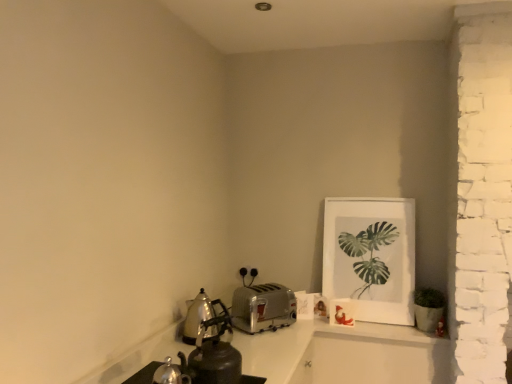
Question: From the image's perspective, is shiny metallic kettle at lower left beneath silver metallic toaster at center, the first kitchen appliance viewed from the right?

Choices:
 (A) yes
 (B) no

Answer: (B)

Question: Considering the relative sizes of shiny metallic kettle at lower left and silver metallic toaster at center, the first kitchen appliance viewed from the right, in the image provided, is shiny metallic kettle at lower left shorter than silver metallic toaster at center, the first kitchen appliance viewed from the right,?

Choices:
 (A) no
 (B) yes

Answer: (A)

Question: From a real-world perspective, is shiny metallic kettle at lower left below silver metallic toaster at center, the first kitchen appliance viewed from the right?

Choices:
 (A) yes
 (B) no

Answer: (B)

Question: Does shiny metallic kettle at lower left lie behind silver metallic toaster at center, the first kitchen appliance viewed from the right?

Choices:
 (A) no
 (B) yes

Answer: (A)

Question: Would you say shiny metallic kettle at lower left is outside silver metallic toaster at center, the second kitchen appliance from the left?

Choices:
 (A) no
 (B) yes

Answer: (B)

Question: From a real-world perspective, is shiny metallic kettle at lower left positioned above or below white matte picture frame at upper right?

Choices:
 (A) above
 (B) below

Answer: (B)

Question: Considering the positions of shiny metallic kettle at lower left and white matte picture frame at upper right in the image, is shiny metallic kettle at lower left taller or shorter than white matte picture frame at upper right?

Choices:
 (A) tall
 (B) short

Answer: (B)

Question: Is shiny metallic kettle at lower left to the left or to the right of white matte picture frame at upper right in the image?

Choices:
 (A) right
 (B) left

Answer: (B)

Question: Relative to white matte picture frame at upper right, is shiny metallic kettle at lower left in front or behind?

Choices:
 (A) front
 (B) behind

Answer: (A)

Question: Considering their positions, is polished stainless steel kettle at left, the second kitchen appliance positioned from the right, located in front of or behind silver metallic toaster at center, the second kitchen appliance from the left?

Choices:
 (A) front
 (B) behind

Answer: (A)

Question: From a real-world perspective, relative to silver metallic toaster at center, the first kitchen appliance viewed from the right, is polished stainless steel kettle at left, the second kitchen appliance positioned from the right, vertically above or below?

Choices:
 (A) above
 (B) below

Answer: (A)

Question: Considering the relative positions of polished stainless steel kettle at left, the second kitchen appliance positioned from the right, and silver metallic toaster at center, the second kitchen appliance from the left, in the image provided, is polished stainless steel kettle at left, the second kitchen appliance positioned from the right, to the left or to the right of silver metallic toaster at center, the second kitchen appliance from the left,?

Choices:
 (A) left
 (B) right

Answer: (A)

Question: From the image's perspective, is polished stainless steel kettle at left, which is the first kitchen appliance in left-to-right order, located above or below silver metallic toaster at center, the second kitchen appliance from the left?

Choices:
 (A) above
 (B) below

Answer: (A)

Question: Based on their sizes in the image, would you say polished stainless steel kettle at left, the second kitchen appliance positioned from the right, is bigger or smaller than shiny metallic kettle at lower left?

Choices:
 (A) small
 (B) big

Answer: (A)

Question: Is polished stainless steel kettle at left, the second kitchen appliance positioned from the right, to the left or to the right of shiny metallic kettle at lower left in the image?

Choices:
 (A) left
 (B) right

Answer: (A)